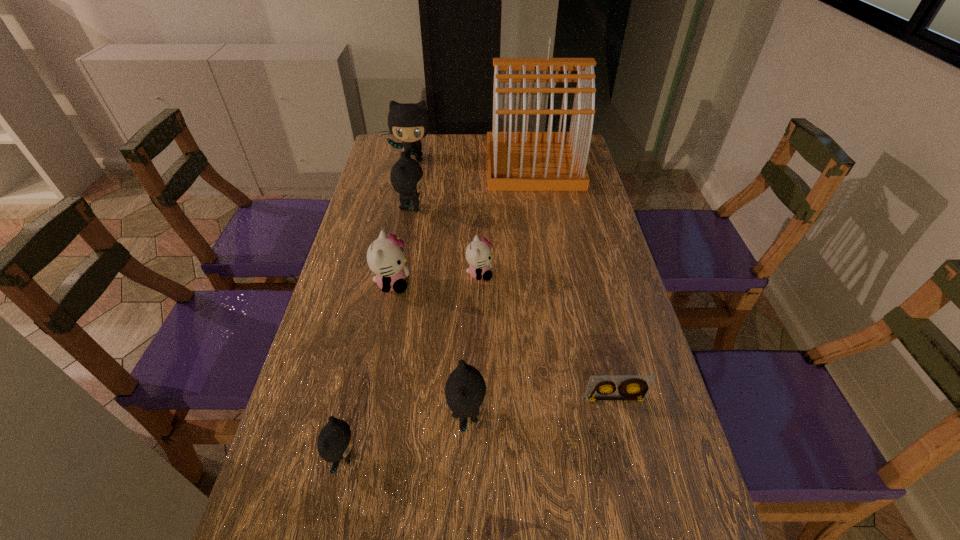
Locate an element on the screen. The image size is (960, 540). free region located 0.270m on the front-facing side of the smallest gray kitten is located at coordinates click(x=495, y=457).

The width and height of the screenshot is (960, 540). Identify the location of free location located at the front of the brown videotape with visible reels. (644, 524).

Find the location of a particular element. This screenshot has height=540, width=960. birdcage that is at the far edge is located at coordinates (516, 161).

The image size is (960, 540). I want to click on kitten located at the far edge, so click(408, 122).

Locate an element on the screen. birdcage located in the right edge section of the desktop is located at coordinates (516, 161).

The height and width of the screenshot is (540, 960). Find the location of `videotape present at the right edge`. videotape present at the right edge is located at coordinates (632, 387).

The width and height of the screenshot is (960, 540). Find the location of `object that is at the far left corner`. object that is at the far left corner is located at coordinates (408, 122).

Where is `object situated at the far right corner`? The image size is (960, 540). object situated at the far right corner is located at coordinates point(516,161).

Locate an element on the screen. The image size is (960, 540). vacant space at the left edge of the desktop is located at coordinates (332, 288).

Image resolution: width=960 pixels, height=540 pixels. In the image, there is a desktop. Find the location of `free space at the right edge`. free space at the right edge is located at coordinates (687, 478).